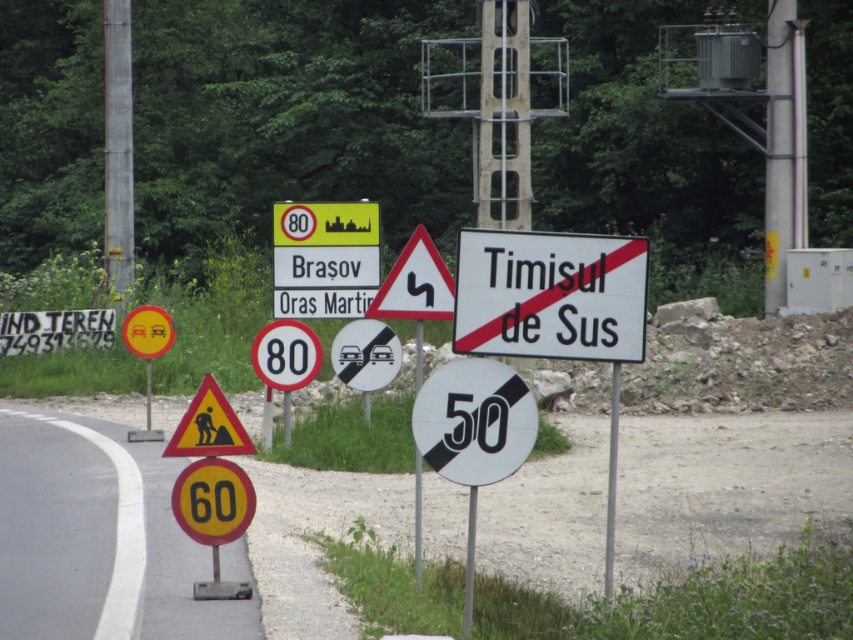
Is white/black circular sign at center wider than brushed metal pole at center?

No, white/black circular sign at center is not wider than brushed metal pole at center.

Which of these two, white/black circular sign at center or brushed metal pole at center, stands shorter?

Standing shorter between the two is white/black circular sign at center.

Locate an element on the screen. This screenshot has width=853, height=640. white/black circular sign at center is located at coordinates (474, 420).

Which is more to the right, white paper sign at center or yellowmaterial/textureconstruction worker at center?

white paper sign at center is more to the right.

Image resolution: width=853 pixels, height=640 pixels. I want to click on white paper sign at center, so click(x=550, y=294).

How much distance is there between yellowmaterial/textureconstruction worker at center and white plastic sign at center?

yellowmaterial/textureconstruction worker at center is 5.49 meters away from white plastic sign at center.

Which of these two, yellowmaterial/textureconstruction worker at center or white plastic sign at center, stands shorter?

Standing shorter between the two is yellowmaterial/textureconstruction worker at center.

Between point (210, 400) and point (419, 568), which one is positioned in front?

Point (210, 400) is in front.

Where is `yellowmaterial/textureconstruction worker at center`? Image resolution: width=853 pixels, height=640 pixels. yellowmaterial/textureconstruction worker at center is located at coordinates (207, 426).